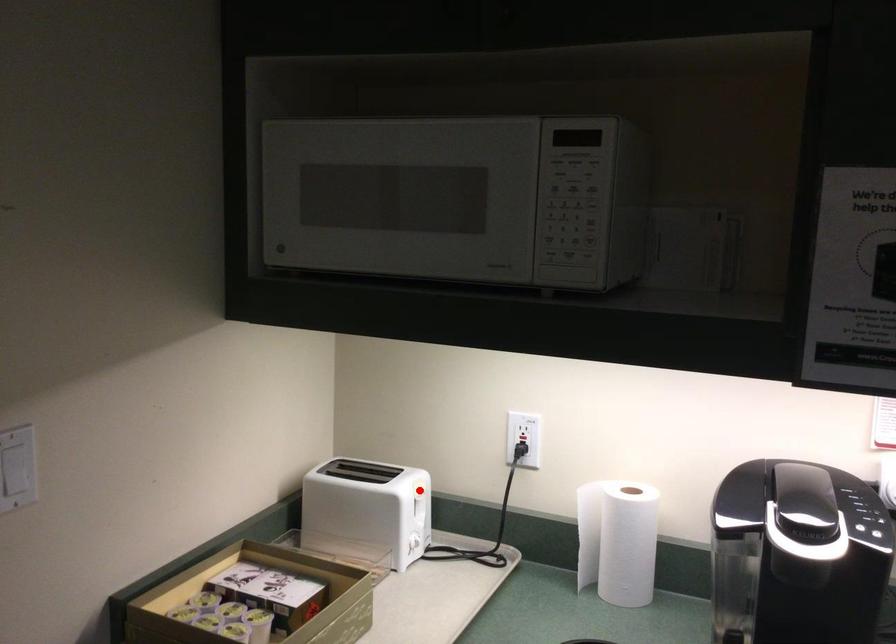
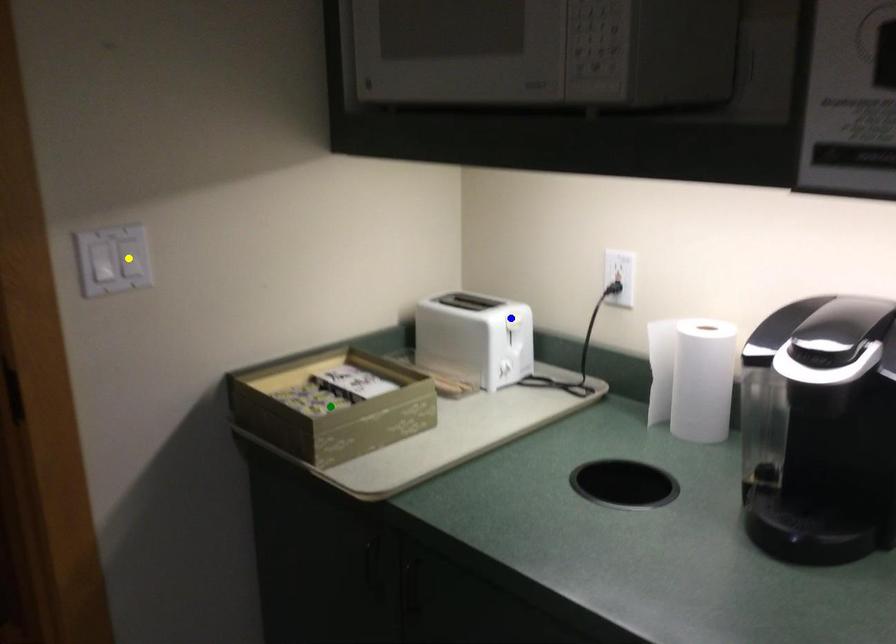
Question: I am providing you with two images of the same scene from different viewpoints. A red point is marked on the first image. You are given multiple points on the second image. Which mark in image 2 goes with the point in image 1?

Choices:
 (A) blue point
 (B) yellow point
 (C) green point

Answer: (A)